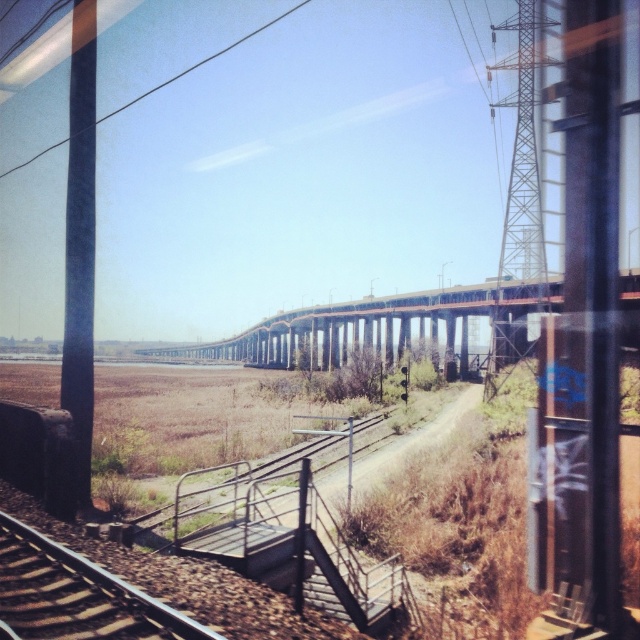
You are a passenger on the train and want to estimate the relative sizes of the objects outside. Which object, the brown gravel train track at lower left or the black wire at upper center, appears smaller in the image?

The brown gravel train track at lower left appears smaller than the black wire at upper center in the image.

In the scene shown: You are a passenger sitting by the window in the train. You notice a black wire at upper center and a rusty steel bridge at center. Which object is positioned to the right of the other?

The rusty steel bridge at center is to the right of the black wire at upper center.

You are a passenger on the train and looking out the window. You notice the rusty steel bridge at center and the black wire at upper center. Which object appears taller in the scene?

The black wire at upper center appears taller than the rusty steel bridge at center because the rusty steel bridge at center has a lesser height compared to black wire at upper center.